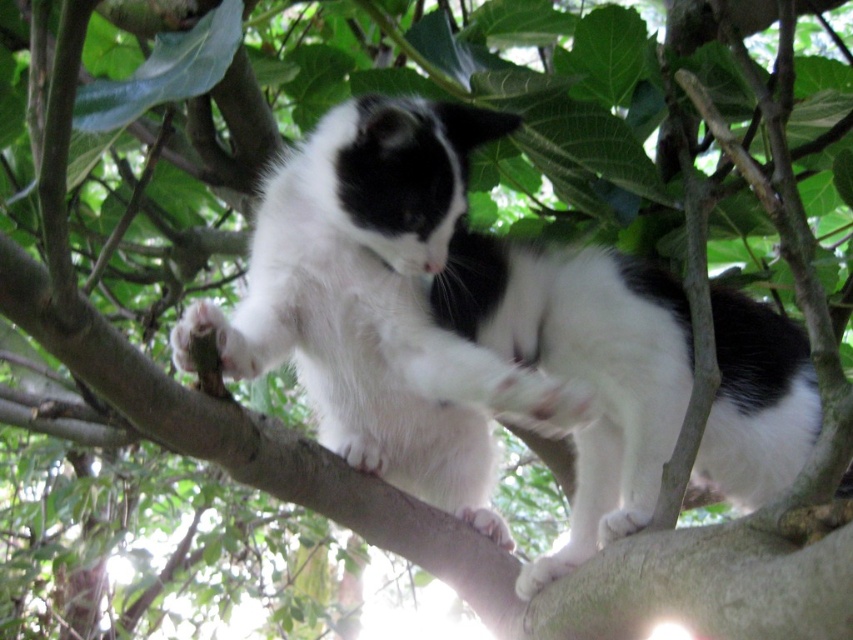
Can you confirm if black and white fur at center is smaller than white soft fur paw at center?

Incorrect, black and white fur at center is not smaller in size than white soft fur paw at center.

I want to click on black and white fur at center, so click(x=583, y=365).

You are a GUI agent. You are given a task and a screenshot of the screen. Output one action in this format:
    pyautogui.click(x=<x>, y=<y>)
    Task: Click on the black and white fur at center
    The width and height of the screenshot is (853, 640).
    Given the screenshot: What is the action you would take?
    pyautogui.click(x=583, y=365)

Who is taller, white fluffy cat at center or white soft fur paw at center?

white fluffy cat at center is taller.

Is white fluffy cat at center to the left of white soft fur paw at center from the viewer's perspective?

In fact, white fluffy cat at center is to the right of white soft fur paw at center.

Is point (393, 216) closer to camera compared to point (202, 326)?

No.

Find the location of a particular element. white fluffy cat at center is located at coordinates (386, 301).

Who is more distant from viewer, (405,362) or (721,400)?

The point (721,400) is behind.

Is white fluffy cat at center positioned at the back of black and white fur at center?

No, white fluffy cat at center is in front of black and white fur at center.

At what (x,y) coordinates should I click in order to perform the action: click on white fluffy cat at center. Please return your answer as a coordinate pair (x, y). Looking at the image, I should click on (386, 301).